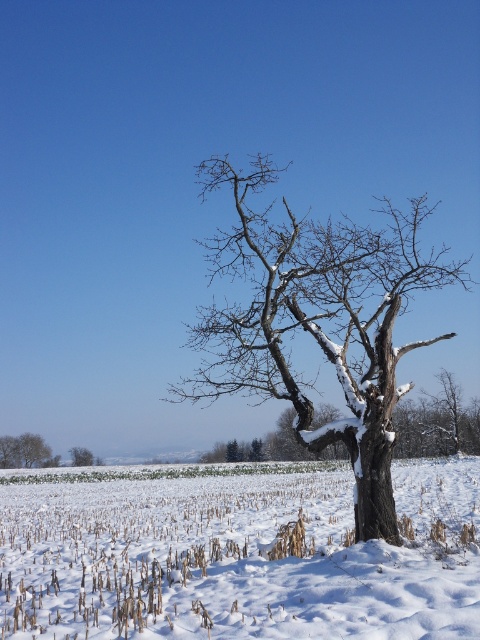
Question: Can you confirm if white snow-covered corn field at center is thinner than snow-covered wood at center?

Choices:
 (A) yes
 (B) no

Answer: (B)

Question: Does snow-covered tree at lower left lie in front of snow-covered tree at center?

Choices:
 (A) yes
 (B) no

Answer: (A)

Question: Which object is positioned farthest from the snow-covered tree at center?

Choices:
 (A) snow-covered tree at lower left
 (B) white snow-covered corn field at center
 (C) snow-covered wood at center

Answer: (C)

Question: Which object is positioned closest to the snow-covered tree at lower left?

Choices:
 (A) snow-covered tree at center
 (B) white snow-covered corn field at center

Answer: (A)

Question: Does white snow-covered corn field at center appear on the left side of snow-covered tree at center?

Choices:
 (A) no
 (B) yes

Answer: (A)

Question: Which of the following is the closest to the observer?

Choices:
 (A) snow-covered wood at center
 (B) white snow-covered corn field at center
 (C) snow-covered tree at lower left

Answer: (B)